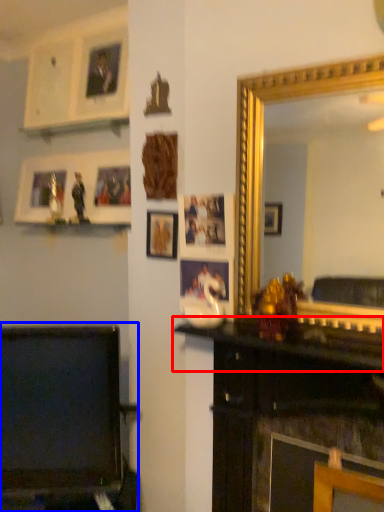
Question: Among these objects, which one is farthest to the camera, mantle (highlighted by a red box) or furniture (highlighted by a blue box)?

Choices:
 (A) mantle
 (B) furniture

Answer: (B)